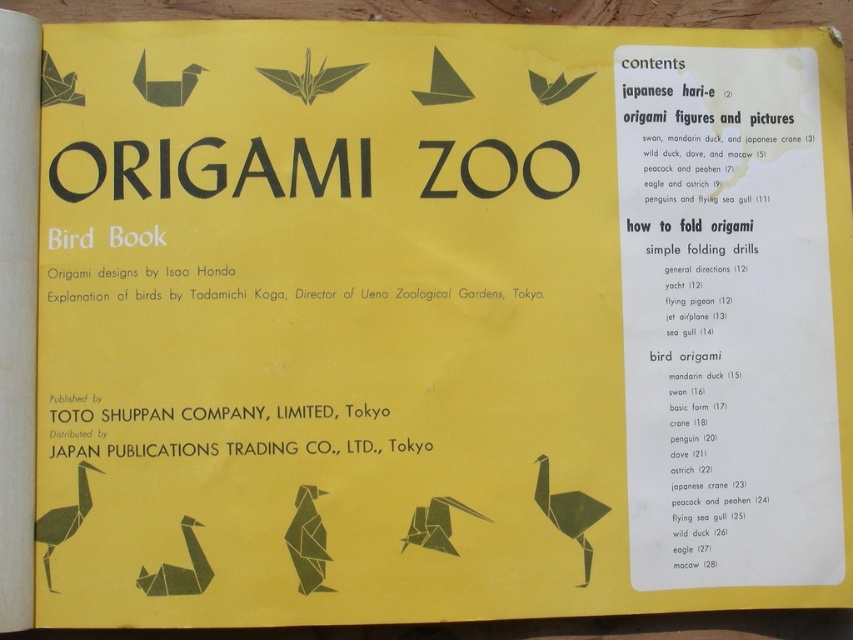
Question: Which object appears farthest from the camera in this image?

Choices:
 (A) matte black ostrich at center
 (B) green paper bird at center

Answer: (A)

Question: Which of the following is the farthest from the observer?

Choices:
 (A) matte green origami bird at center
 (B) matte black ostrich at center
 (C) matte green origami swan at lower left

Answer: (B)

Question: Which is farther from the matte green origami bird at center?

Choices:
 (A) matte green origami swan at lower left
 (B) green paper crane at lower left
 (C) matte black ostrich at center

Answer: (B)

Question: Can you confirm if green paper bird at center is positioned below matte black ostrich at center?

Choices:
 (A) yes
 (B) no

Answer: (A)

Question: Does green paper bird at center appear on the right side of matte green origami swan at lower left?

Choices:
 (A) no
 (B) yes

Answer: (B)

Question: Can you confirm if matte green origami swan at lower left is wider than green paper crane at lower left?

Choices:
 (A) yes
 (B) no

Answer: (A)